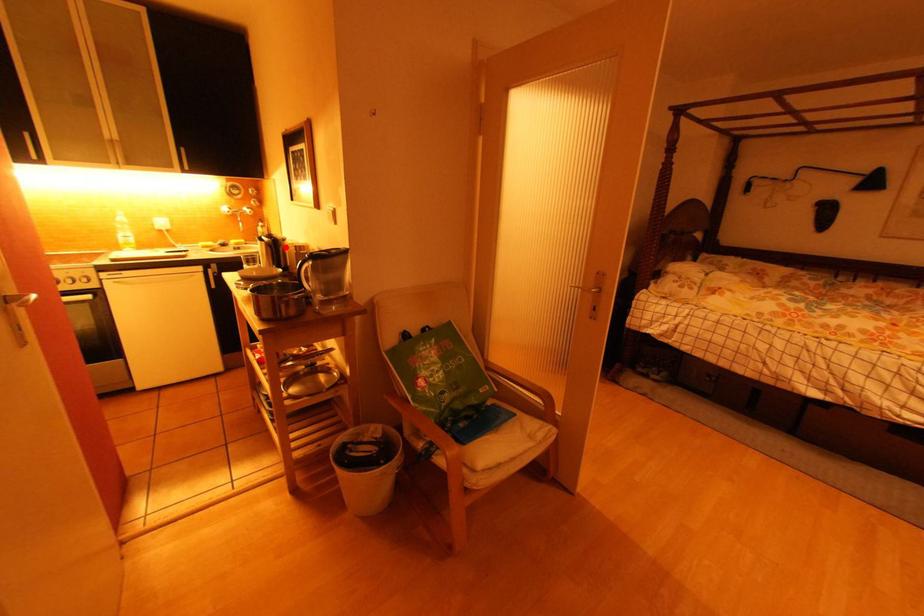
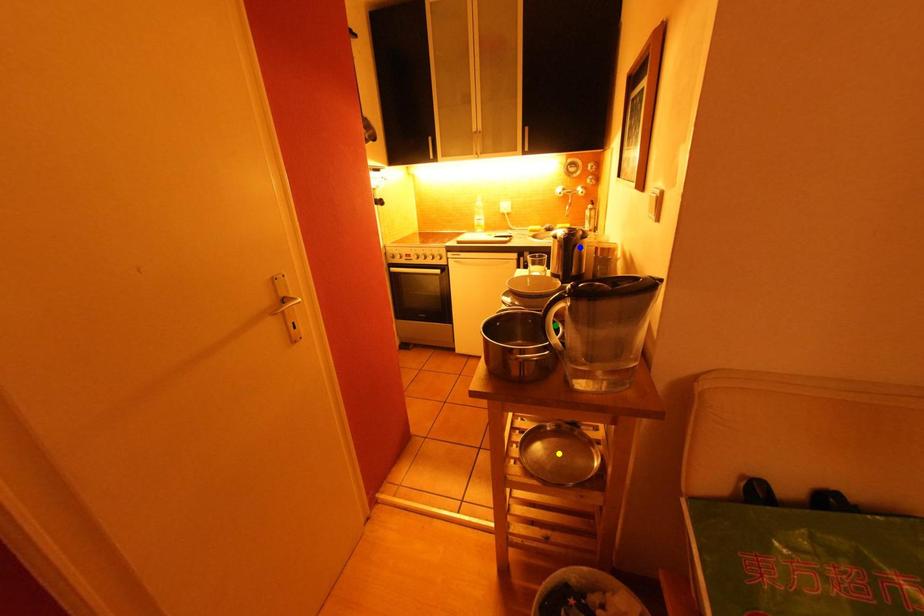
Question: I am providing you with two images of the same scene from different viewpoints. A red point is marked on the first image. You are given multiple points on the second image. Which spot in image 2 lines up with the point in image 1?

Choices:
 (A) green point
 (B) blue point
 (C) yellow point

Answer: (B)